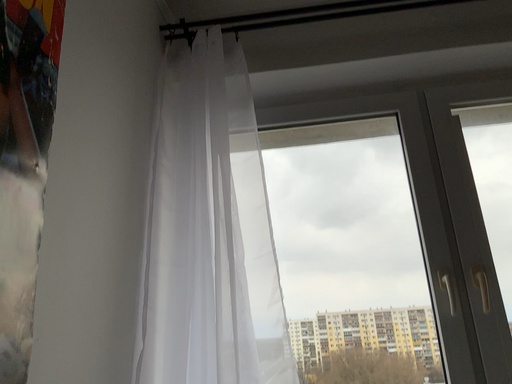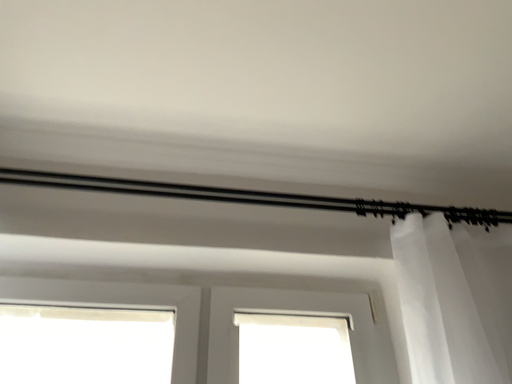
Question: How did the camera likely rotate when shooting the video?

Choices:
 (A) rotated downward
 (B) rotated upward

Answer: (B)